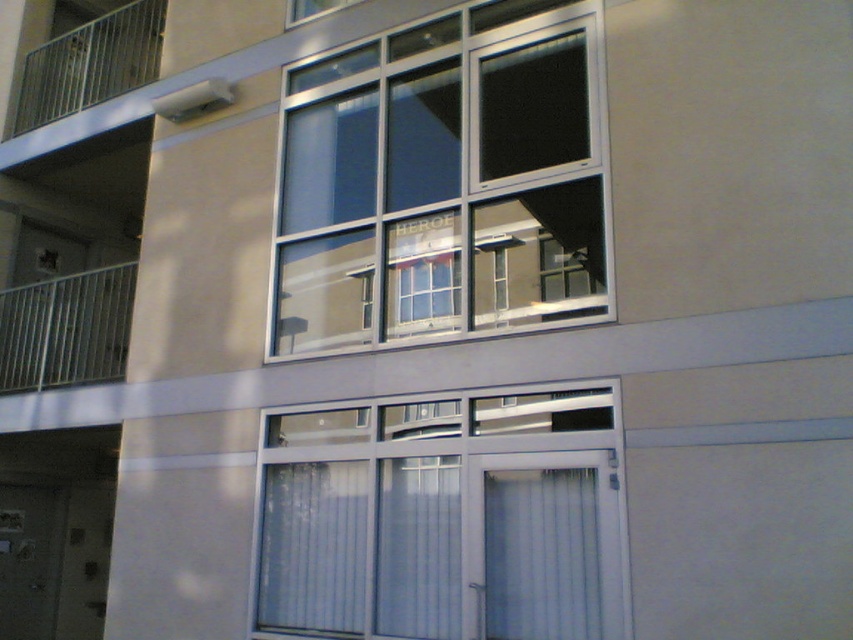
Question: Considering the relative positions of white fabric curtain at lower center and transparent glass window at upper center in the image provided, where is white fabric curtain at lower center located with respect to transparent glass window at upper center?

Choices:
 (A) left
 (B) right

Answer: (B)

Question: Which object appears closest to the camera in this image?

Choices:
 (A) transparent glass window at upper center
 (B) white sheer curtain at lower center
 (C) metallic silver balcony at left
 (D) white plastic window at center

Answer: (D)

Question: Can you confirm if clear glass window at center is bigger than metallic silver balcony at left?

Choices:
 (A) yes
 (B) no

Answer: (A)

Question: Is white fabric curtain at lower center smaller than metallic railing at upper left?

Choices:
 (A) yes
 (B) no

Answer: (A)

Question: Which is nearer to the transparent glass window at upper center?

Choices:
 (A) transparent glass door at lower left
 (B) clear glass window at center
 (C) metallic silver balcony at left

Answer: (B)

Question: Which of the following is the closest to the observer?

Choices:
 (A) (276, 548)
 (B) (303, 592)
 (C) (115, 72)

Answer: (B)